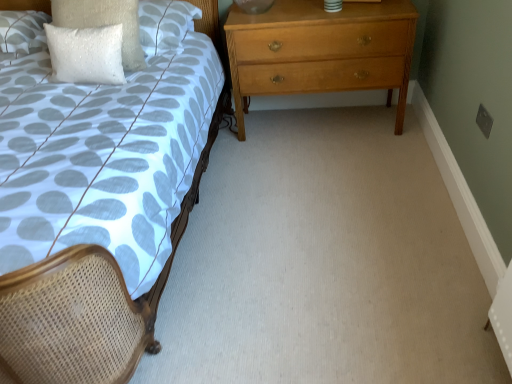
Question: Can you confirm if white sequined pillow at upper left, the 1th pillow when ordered from right to left, is positioned to the left of white textured pillow at upper left, the third pillow viewed from the right?

Choices:
 (A) yes
 (B) no

Answer: (B)

Question: Is white sequined pillow at upper left, the 1th pillow when ordered from right to left, with white textured pillow at upper left, the third pillow viewed from the right?

Choices:
 (A) no
 (B) yes

Answer: (A)

Question: Considering the relative sizes of white sequined pillow at upper left, placed as the 3th pillow when sorted from left to right, and white textured pillow at upper left, the 1th pillow viewed from the left, in the image provided, is white sequined pillow at upper left, placed as the 3th pillow when sorted from left to right, taller than white textured pillow at upper left, the 1th pillow viewed from the left,?

Choices:
 (A) no
 (B) yes

Answer: (B)

Question: From the image's perspective, is white sequined pillow at upper left, placed as the 3th pillow when sorted from left to right, located above white textured pillow at upper left, the 1th pillow viewed from the left?

Choices:
 (A) yes
 (B) no

Answer: (B)

Question: Is white sequined pillow at upper left, placed as the 3th pillow when sorted from left to right, far from white textured pillow at upper left, the third pillow viewed from the right?

Choices:
 (A) yes
 (B) no

Answer: (B)

Question: Is white sequined pillow at upper left, placed as the 3th pillow when sorted from left to right, at the right side of white textured pillow at upper left, the 1th pillow viewed from the left?

Choices:
 (A) no
 (B) yes

Answer: (B)

Question: Can you confirm if white textured pillow at upper left, the 1th pillow viewed from the left, is thinner than matte woven bed at left?

Choices:
 (A) no
 (B) yes

Answer: (B)

Question: From the image's perspective, is white textured pillow at upper left, the third pillow viewed from the right, over matte woven bed at left?

Choices:
 (A) no
 (B) yes

Answer: (B)

Question: Can you confirm if white textured pillow at upper left, the 1th pillow viewed from the left, is taller than matte woven bed at left?

Choices:
 (A) no
 (B) yes

Answer: (A)

Question: Is white textured pillow at upper left, the third pillow viewed from the right, shorter than matte woven bed at left?

Choices:
 (A) no
 (B) yes

Answer: (B)

Question: Is white textured pillow at upper left, the third pillow viewed from the right, turned away from matte woven bed at left?

Choices:
 (A) no
 (B) yes

Answer: (B)

Question: Is white textured pillow at upper left, the 1th pillow viewed from the left, placed right next to matte woven bed at left?

Choices:
 (A) no
 (B) yes

Answer: (A)

Question: Is white sequined pillow at upper left, the 2th pillow positioned from the right, further to the viewer compared to white textured pillow at upper left, the third pillow viewed from the right?

Choices:
 (A) no
 (B) yes

Answer: (A)